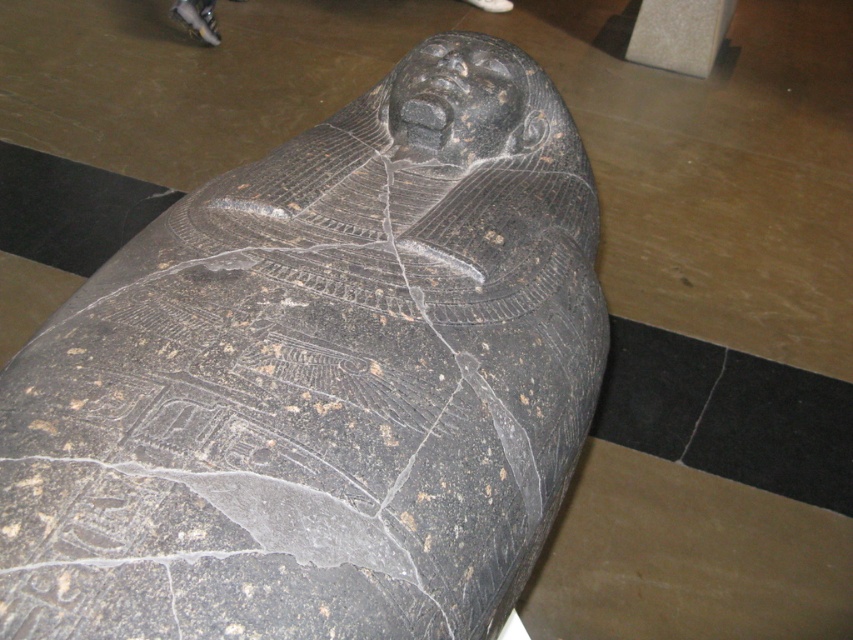
Between point (697, 58) and point (706, 394), which one is positioned behind?

The point (697, 58) is more distant.

Is smooth gray stone at upper right above black stone crack at lower right?

Yes, smooth gray stone at upper right is above black stone crack at lower right.

The height and width of the screenshot is (640, 853). I want to click on smooth gray stone at upper right, so click(679, 33).

What do you see at coordinates (320, 380) in the screenshot? I see `black stone sarcophagus at center` at bounding box center [320, 380].

From the picture: Who is more distant from viewer, (421, 280) or (715, 29)?

The point (715, 29) is more distant.

Image resolution: width=853 pixels, height=640 pixels. What are the coordinates of `black stone sarcophagus at center` in the screenshot? It's located at (320, 380).

Does black stone sarcophagus at center have a larger size compared to black stone crack at lower right?

Indeed, black stone sarcophagus at center has a larger size compared to black stone crack at lower right.

Identify the location of black stone sarcophagus at center. (320, 380).

Identify the location of black stone sarcophagus at center. (320, 380).